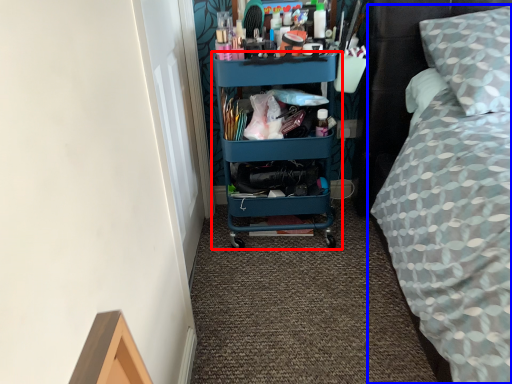
Question: Which point is further to the camera, shelf (highlighted by a red box) or bed (highlighted by a blue box)?

Choices:
 (A) shelf
 (B) bed

Answer: (A)